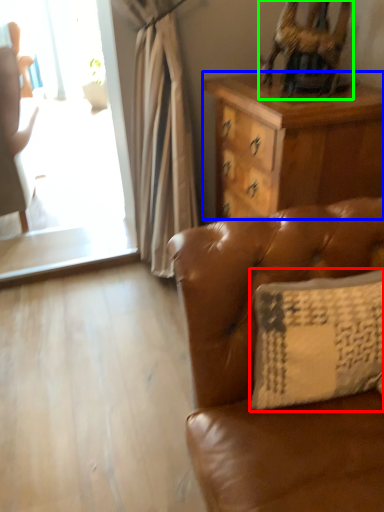
Question: Which is nearer to the pillow (highlighted by a red box)? desk (highlighted by a blue box) or swivel chair (highlighted by a green box).

Choices:
 (A) desk
 (B) swivel chair

Answer: (A)